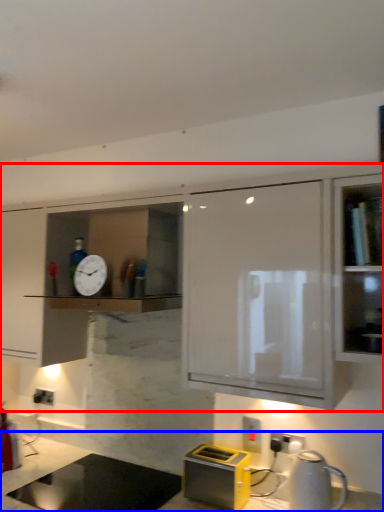
Question: Which point is further to the camera, cabinetry (highlighted by a red box) or countertop (highlighted by a blue box)?

Choices:
 (A) cabinetry
 (B) countertop

Answer: (A)